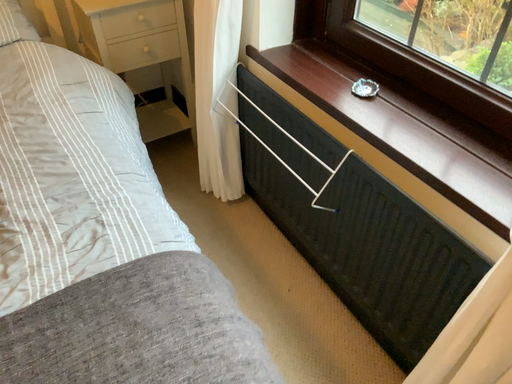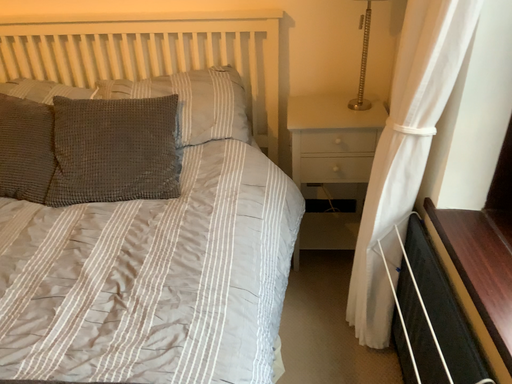
Question: How did the camera likely rotate when shooting the video?

Choices:
 (A) rotated downward
 (B) rotated upward

Answer: (B)